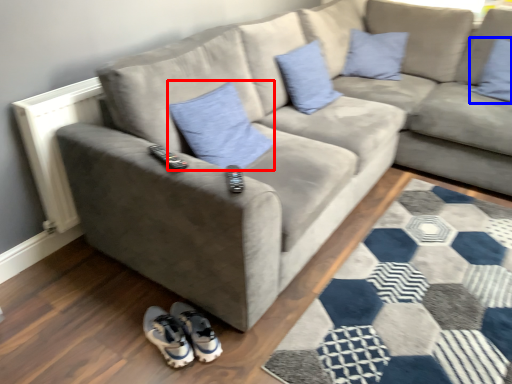
Question: Which object is further to the camera taking this photo, pillow (highlighted by a red box) or pillow (highlighted by a blue box)?

Choices:
 (A) pillow
 (B) pillow

Answer: (B)